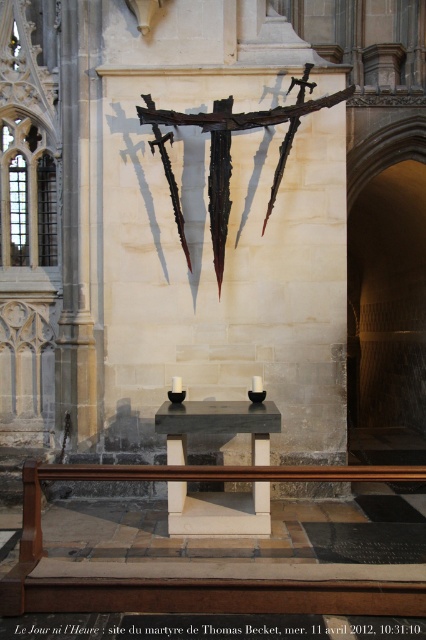
Question: Which object is farther from the camera taking this photo?

Choices:
 (A) rusty metal crucifix at upper center
 (B) black polished stone altar at center

Answer: (A)

Question: Is black polished stone altar at center below rusty metal crucifix at upper center?

Choices:
 (A) yes
 (B) no

Answer: (A)

Question: Does black polished stone altar at center have a smaller size compared to rusty metal crucifix at upper center?

Choices:
 (A) yes
 (B) no

Answer: (A)

Question: Can you confirm if black polished stone altar at center is positioned above rusty metal crucifix at upper center?

Choices:
 (A) yes
 (B) no

Answer: (B)